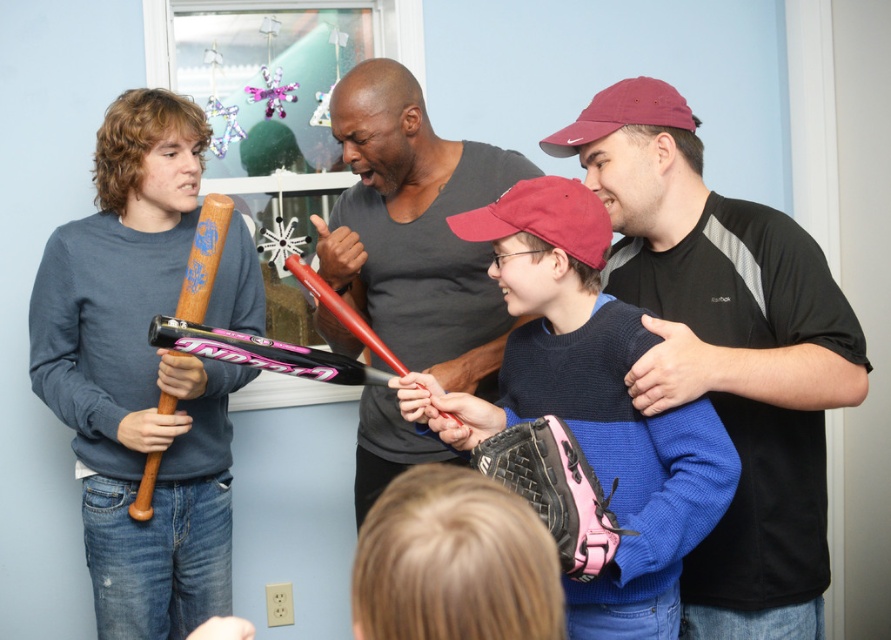
Consider the image. Who is positioned more to the right, smooth gray shirt at center or wooden baseball bat at left?

smooth gray shirt at center is more to the right.

Between point (452, 184) and point (192, 296), which one is positioned in front?

Point (192, 296) is more forward.

In order to click on smooth gray shirt at center in this screenshot , I will do `click(415, 228)`.

Is pink leather baseball glove at lower center to the right of maroon fabric baseball cap at upper right from the viewer's perspective?

No, pink leather baseball glove at lower center is not to the right of maroon fabric baseball cap at upper right.

Based on the photo, is pink leather baseball glove at lower center wider than maroon fabric baseball cap at upper right?

No.

Which is in front, point (574, 490) or point (612, 116)?

Point (574, 490) is more forward.

Image resolution: width=891 pixels, height=640 pixels. I want to click on pink leather baseball glove at lower center, so click(556, 490).

Is pink leather baseball glove at center shorter than wooden baseball bat at left?

Incorrect, pink leather baseball glove at center's height does not fall short of wooden baseball bat at left's.

Who is more distant from viewer, (446, 426) or (198, 316)?

The point (198, 316) is more distant.

This screenshot has width=891, height=640. Identify the location of pink leather baseball glove at center. (589, 403).

I want to click on pink leather baseball glove at center, so click(x=589, y=403).